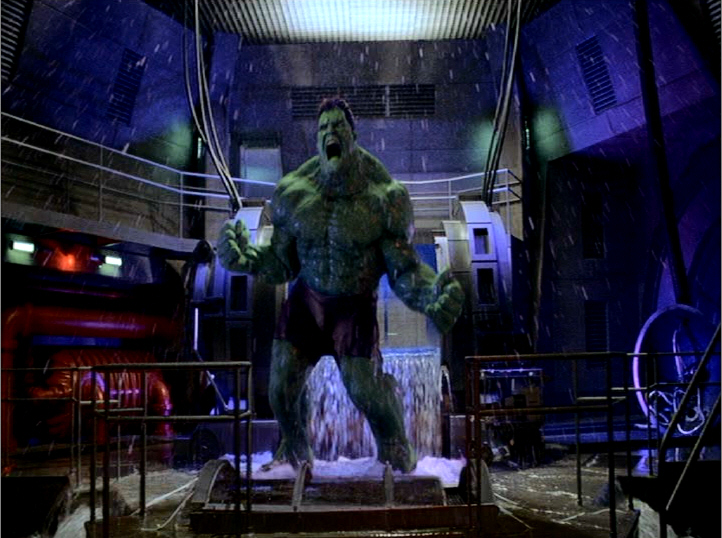
Locate an element on the screen. The height and width of the screenshot is (538, 722). floor is located at coordinates click(578, 485).